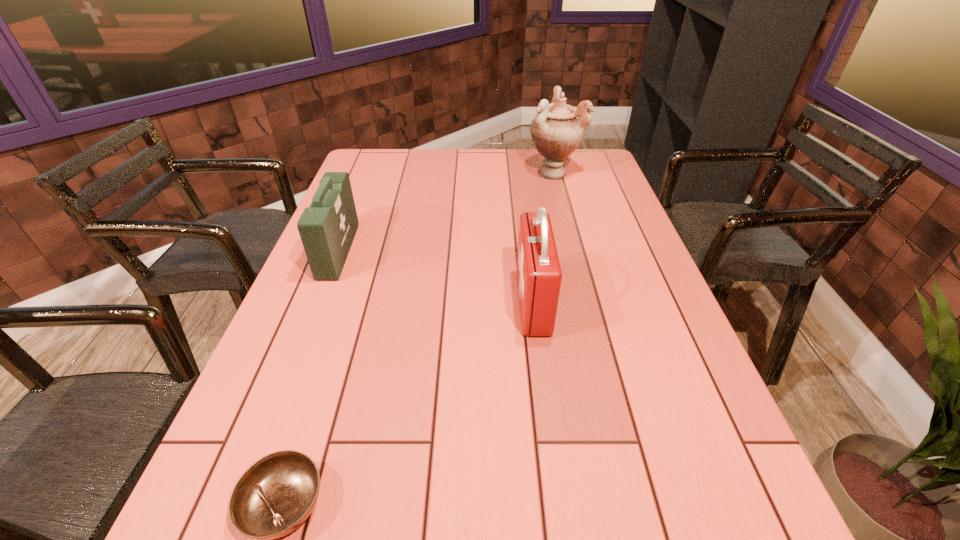
The height and width of the screenshot is (540, 960). I want to click on urn, so click(x=556, y=131).

Identify the location of the farthest object. Image resolution: width=960 pixels, height=540 pixels. (556, 131).

Identify the location of the right first-aid kit. (539, 275).

I want to click on the second object from right to left, so click(x=539, y=275).

In order to click on the shorter first-aid kit in this screenshot , I will do `click(327, 228)`.

Where is `the left first-aid kit`? The height and width of the screenshot is (540, 960). the left first-aid kit is located at coordinates (327, 228).

The image size is (960, 540). Find the location of `free point located 0.060m on the right of the rightmost object`. free point located 0.060m on the right of the rightmost object is located at coordinates (x=596, y=172).

Find the location of a particular element. Image resolution: width=960 pixels, height=540 pixels. free location located 0.270m on the front face of the second object from right to left is located at coordinates (409, 302).

Locate an element on the screen. The height and width of the screenshot is (540, 960). free point located on the front face of the second object from right to left is located at coordinates (364, 302).

This screenshot has width=960, height=540. In order to click on free spot located 0.180m on the front face of the second object from right to left in this screenshot , I will do `click(445, 302)`.